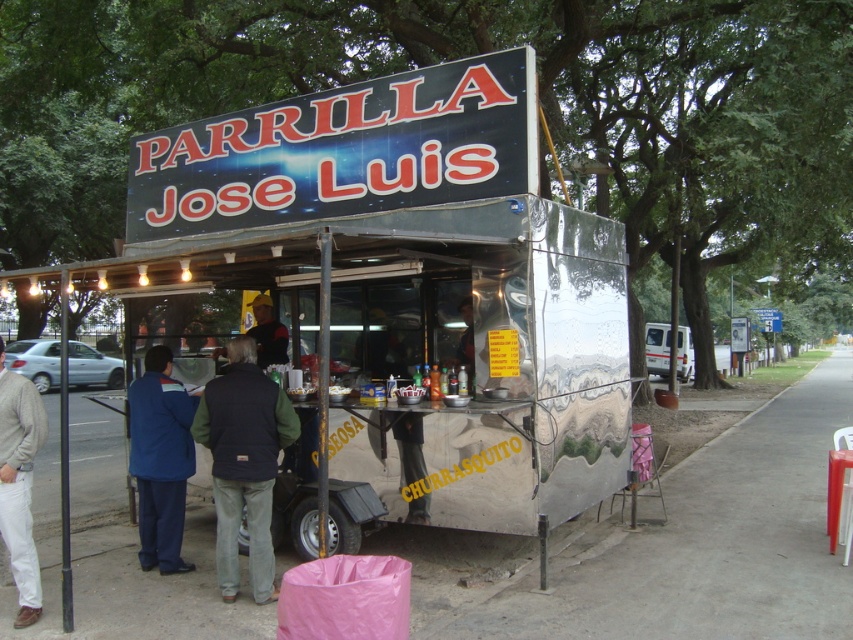
You are standing at the entrance of the food stall named Parrilla Jose Luis. You want to place a new menu board on the ground at the exact center of the stall. The stall has a metallic pavement at lower center. Where should you place the menu board so that it is centered relative to the stall?

The metallic pavement at lower center is located at point (666, 544), so placing the menu board at this coordinate will center it relative to the stall.

Based on the photo, you are a customer at the Parrilla Jose Luis food stall. You want to grab the dark blue vest at center and the blue fabric jacket at left. However, you can only reach items within 30 inches. Can you reach both items without moving?

The dark blue vest at center is 30.46 inches away from the blue fabric jacket at left. Since the distance between them is slightly over 30 inches, you cannot reach both items without moving.

You are a customer at the Parrilla Jose Luis food stall. You notice two items on the counter near the menu board. One is a dark blue vest at center and the other is a blue fabric jacket at left. Which of these items is larger in size?

The dark blue vest at center is bigger than the blue fabric jacket at left.